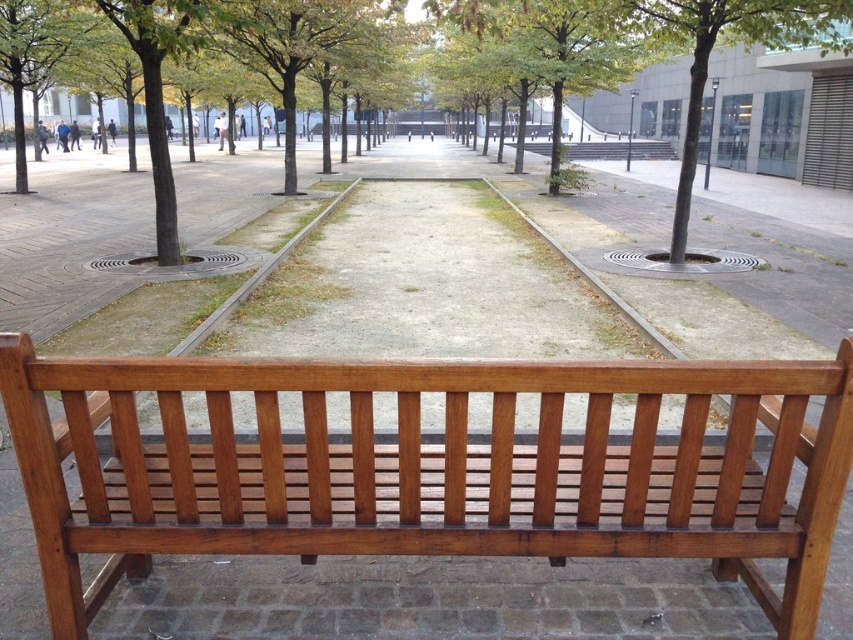
You are sitting on the shiny brown wood bench at center and want to look up at the green leafy tree at upper right. In which direction should you tilt your head to see the tree?

You should tilt your head upward because the shiny brown wood bench at center is located below the green leafy tree at upper right.

You are planning to place a new bench in the park. The shiny brown wood bench at center is currently in the way. Can you move it to the area where the green leafy tree at upper right is located?

The shiny brown wood bench at center occupies less space than green leafy tree at upper right, so it cannot be moved there because the space occupied by the bench is smaller than the area taken up by the tree.